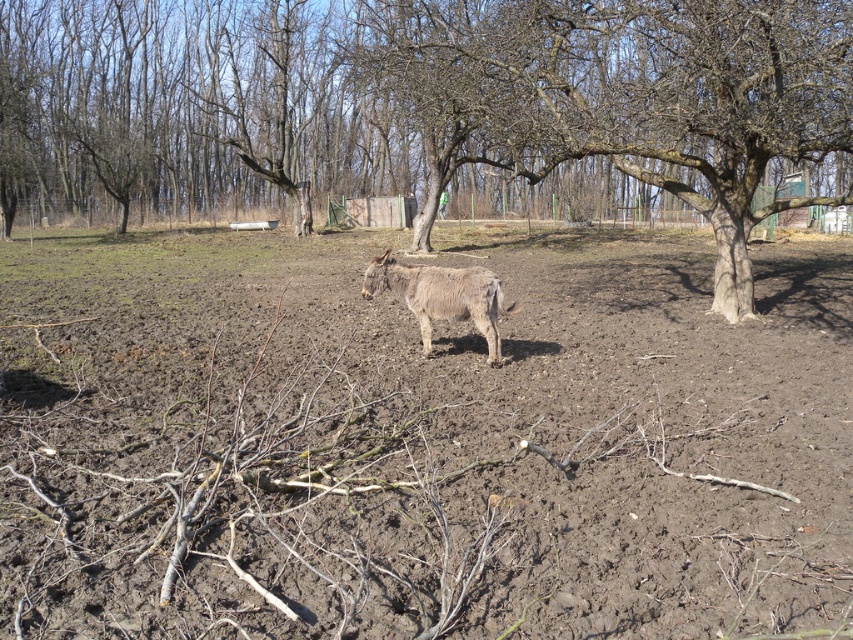
Can you confirm if brown soil at center is positioned to the right of bare bark tree at center?

Incorrect, brown soil at center is not on the right side of bare bark tree at center.

Does point (283, 582) lie behind point (381, 64)?

No, it is in front of (381, 64).

You are a GUI agent. You are given a task and a screenshot of the screen. Output one action in this format:
    pyautogui.click(x=<x>, y=<y>)
    Task: Click on the brown soil at center
    The height and width of the screenshot is (640, 853).
    Given the screenshot: What is the action you would take?
    pyautogui.click(x=418, y=444)

Is bare bark tree at center to the left of fuzzy brown donkey at center from the viewer's perspective?

Incorrect, bare bark tree at center is not on the left side of fuzzy brown donkey at center.

Does bare bark tree at center appear on the right side of fuzzy brown donkey at center?

Indeed, bare bark tree at center is positioned on the right side of fuzzy brown donkey at center.

The image size is (853, 640). Describe the element at coordinates (640, 93) in the screenshot. I see `bare bark tree at center` at that location.

Identify the location of bare bark tree at center. (640, 93).

Does brown soil at center have a lesser height compared to fuzzy brown donkey at center?

Incorrect, brown soil at center's height does not fall short of fuzzy brown donkey at center's.

Is brown soil at center to the right of fuzzy brown donkey at center from the viewer's perspective?

No, brown soil at center is not to the right of fuzzy brown donkey at center.

Who is more distant from viewer, (648, 616) or (463, 284)?

The point (463, 284) is behind.

The image size is (853, 640). I want to click on brown soil at center, so click(418, 444).